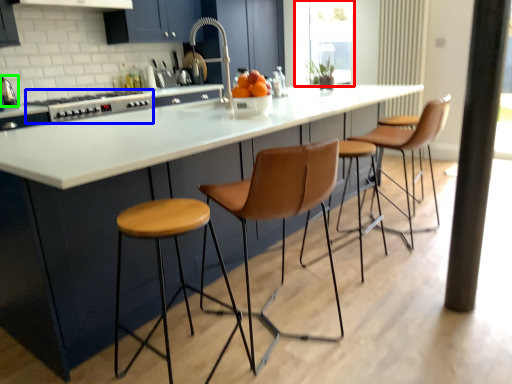
Question: Based on their relative distances, which object is farther from window screen (highlighted by a red box)? Choose from appliance (highlighted by a blue box) and kitchen appliance (highlighted by a green box).

Choices:
 (A) appliance
 (B) kitchen appliance

Answer: (B)